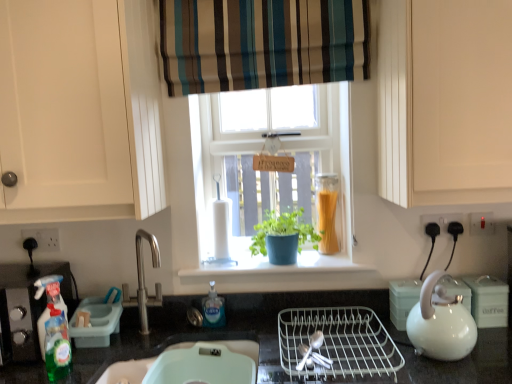
Question: From the image's perspective, is clear plastic bottle at lower center, the first bottle from the right, located above green matte plant pot at center?

Choices:
 (A) yes
 (B) no

Answer: (B)

Question: Can you confirm if clear plastic bottle at lower center, which is counted as the 1th bottle, starting from the back, is smaller than green matte plant pot at center?

Choices:
 (A) yes
 (B) no

Answer: (A)

Question: Could you tell me if clear plastic bottle at lower center, the 2th bottle positioned from the front, is facing green matte plant pot at center?

Choices:
 (A) yes
 (B) no

Answer: (B)

Question: Does clear plastic bottle at lower center, positioned as the second bottle in left-to-right order, have a greater height compared to green matte plant pot at center?

Choices:
 (A) no
 (B) yes

Answer: (A)

Question: Is clear plastic bottle at lower center, positioned as the second bottle in left-to-right order, located outside green matte plant pot at center?

Choices:
 (A) no
 (B) yes

Answer: (B)

Question: Would you consider clear plastic bottle at lower center, the 2th bottle positioned from the front, to be distant from green matte plant pot at center?

Choices:
 (A) yes
 (B) no

Answer: (B)

Question: From the image's perspective, would you say green plastic dish soap dispenser at left, the first appliance positioned from the left, is shown under white wire dish rack at center, which is the third appliance in right-to-left order?

Choices:
 (A) yes
 (B) no

Answer: (B)

Question: From the image's perspective, is green plastic dish soap dispenser at left, which ranks as the fourth appliance in right-to-left order, on top of white wire dish rack at center, the 2th appliance when ordered from left to right?

Choices:
 (A) no
 (B) yes

Answer: (B)

Question: Does green plastic dish soap dispenser at left, the first appliance positioned from the left, have a greater height compared to white wire dish rack at center, which is the third appliance in right-to-left order?

Choices:
 (A) yes
 (B) no

Answer: (A)

Question: Would you say green plastic dish soap dispenser at left, the first appliance positioned from the left, contains white wire dish rack at center, which is the third appliance in right-to-left order?

Choices:
 (A) no
 (B) yes

Answer: (A)

Question: From a real-world perspective, is green plastic dish soap dispenser at left, the first appliance positioned from the left, physically above white wire dish rack at center, the 2th appliance when ordered from left to right?

Choices:
 (A) yes
 (B) no

Answer: (A)

Question: Can you confirm if green plastic dish soap dispenser at left, which ranks as the fourth appliance in right-to-left order, is shorter than white wire dish rack at center, the 2th appliance when ordered from left to right?

Choices:
 (A) yes
 (B) no

Answer: (B)

Question: Can you confirm if translucent glass jar at window is wider than white glossy teapot at right, the 2th appliance in the right-to-left sequence?

Choices:
 (A) no
 (B) yes

Answer: (A)